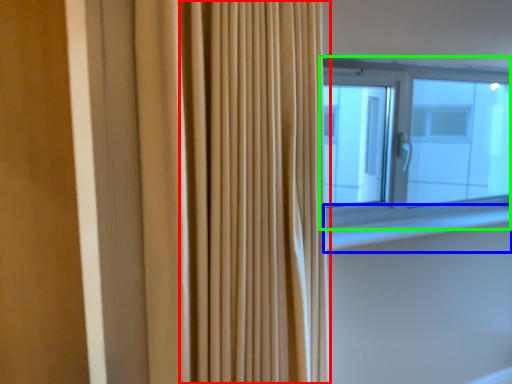
Question: Which object is positioned farthest from shower curtain (highlighted by a red box)? Select from window sill (highlighted by a blue box) and window (highlighted by a green box).

Choices:
 (A) window sill
 (B) window

Answer: (B)